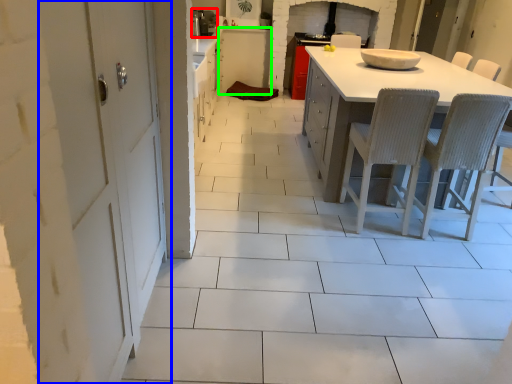
Question: Considering the real-world distances, which object is farthest from appliance (highlighted by a red box)? door (highlighted by a blue box) or cabinetry (highlighted by a green box)?

Choices:
 (A) door
 (B) cabinetry

Answer: (A)